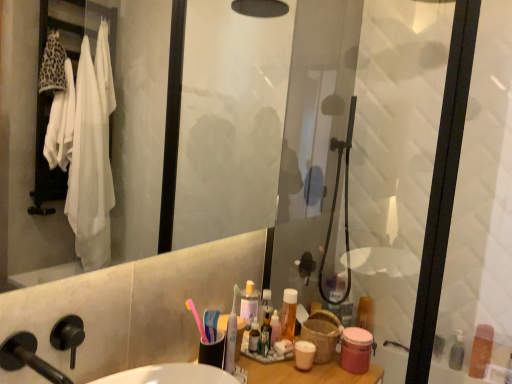
Question: Is pink matte jar at lower right, the fourth toiletry when ordered from back to front, surrounding black matte faucet at lower left?

Choices:
 (A) yes
 (B) no

Answer: (B)

Question: From the image's perspective, is pink matte jar at lower right, the 2th toiletry when ordered from left to right, on top of black matte faucet at lower left?

Choices:
 (A) yes
 (B) no

Answer: (B)

Question: Is black matte faucet at lower left at the back of pink matte jar at lower right, the fourth toiletry when ordered from back to front?

Choices:
 (A) yes
 (B) no

Answer: (B)

Question: Can you confirm if pink matte jar at lower right, the fourth toiletry when ordered from back to front, is smaller than black matte faucet at lower left?

Choices:
 (A) yes
 (B) no

Answer: (A)

Question: Can we say pink matte jar at lower right, the 2th toiletry when ordered from left to right, lies outside black matte faucet at lower left?

Choices:
 (A) no
 (B) yes

Answer: (B)

Question: Is pink matte jar at lower right, placed as the 3th toiletry when sorted from right to left, positioned far away from black matte faucet at lower left?

Choices:
 (A) yes
 (B) no

Answer: (B)

Question: Considering the relative positions of translucent orange bottle at upper right, placed as the first toiletry when sorted from left to right, and translucent plastic bottle at lower right, placed as the first toiletry when sorted from right to left, in the image provided, is translucent orange bottle at upper right, placed as the first toiletry when sorted from left to right, to the left of translucent plastic bottle at lower right, placed as the first toiletry when sorted from right to left, from the viewer's perspective?

Choices:
 (A) no
 (B) yes

Answer: (B)

Question: Is translucent orange bottle at upper right, which is the fourth toiletry from right to left, facing away from translucent plastic bottle at lower right, which is the second toiletry in back-to-front order?

Choices:
 (A) yes
 (B) no

Answer: (B)

Question: Is the depth of translucent orange bottle at upper right, which is the fourth toiletry from right to left, less than that of translucent plastic bottle at lower right, which is the second toiletry in back-to-front order?

Choices:
 (A) yes
 (B) no

Answer: (A)

Question: Is translucent orange bottle at upper right, placed as the first toiletry when sorted from left to right, aimed at translucent plastic bottle at lower right, placed as the first toiletry when sorted from right to left?

Choices:
 (A) no
 (B) yes

Answer: (A)

Question: From a real-world perspective, is translucent orange bottle at upper right, placed as the first toiletry when sorted from left to right, over translucent plastic bottle at lower right, placed as the first toiletry when sorted from right to left?

Choices:
 (A) yes
 (B) no

Answer: (A)

Question: Can you confirm if translucent orange bottle at upper right, the 2th toiletry positioned from the front, is wider than translucent plastic bottle at lower right, the 4th toiletry when ordered from left to right?

Choices:
 (A) no
 (B) yes

Answer: (A)

Question: Considering the relative sizes of pink matte jar at lower right, the 2th toiletry when ordered from left to right, and transparent glass shower door at right in the image provided, is pink matte jar at lower right, the 2th toiletry when ordered from left to right, taller than transparent glass shower door at right?

Choices:
 (A) no
 (B) yes

Answer: (A)